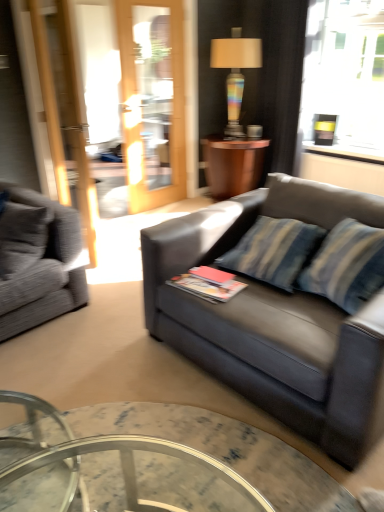
At what (x,y) coordinates should I click in order to perform the action: click on empty space that is ontop of matte paper book at center (from a real-world perspective). Please return your answer as a coordinate pair (x, y). Looking at the image, I should click on tap(207, 275).